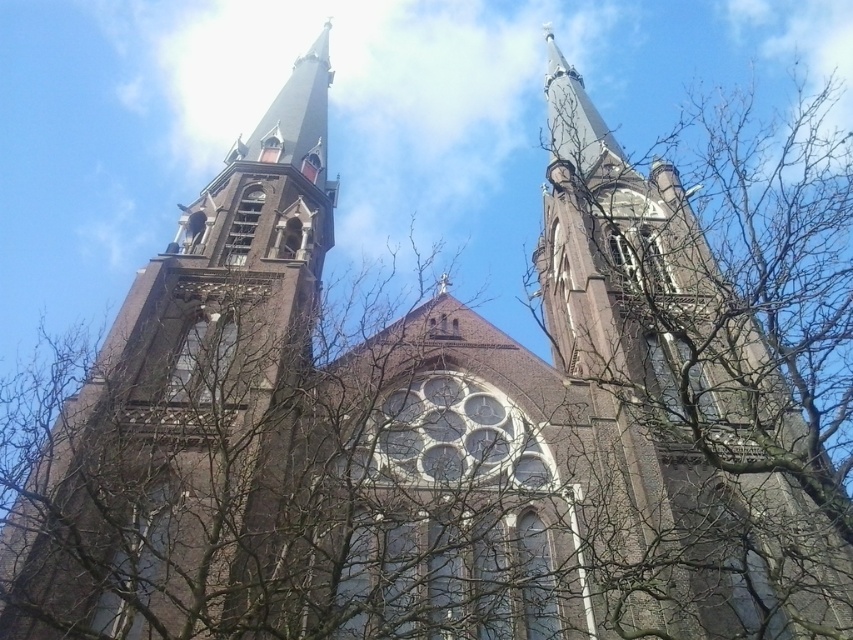
You are standing in front of the church and want to take a photo that includes both the brown brick tower at upper left and the brown brick tower at center. Which tower should you position closer to the bottom of your camera frame to ensure both are fully visible?

The brown brick tower at upper left is not as tall as the brown brick tower at center, so you should position the brown brick tower at upper left closer to the bottom of your camera frame to ensure both are fully visible.